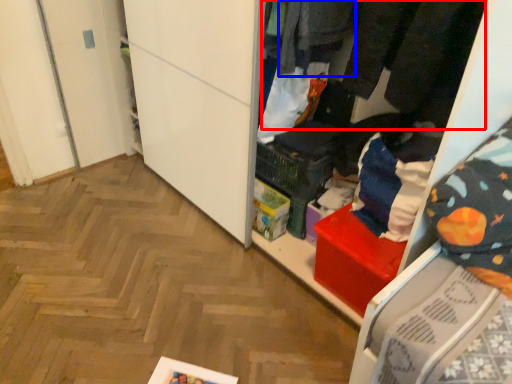
Question: Which of the following is the farthest to the observer, clothing (highlighted by a red box) or clothing (highlighted by a blue box)?

Choices:
 (A) clothing
 (B) clothing

Answer: (B)